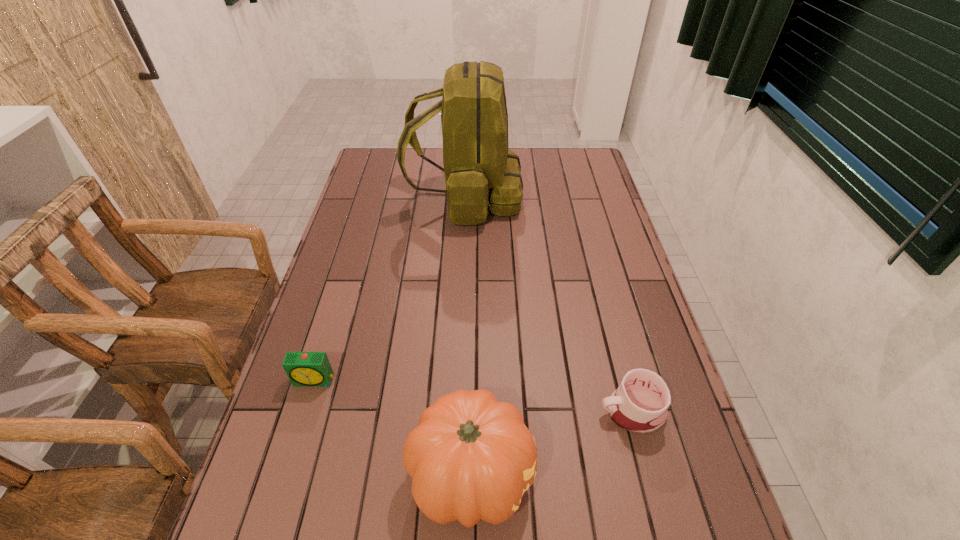
I want to click on object positioned at the far edge, so click(480, 171).

This screenshot has width=960, height=540. I want to click on object that is at the left edge, so click(302, 368).

The image size is (960, 540). I want to click on object that is at the right edge, so click(x=639, y=405).

Where is `vacant space at the far edge of the desktop`? vacant space at the far edge of the desktop is located at coordinates (409, 157).

Locate an element on the screen. free space at the left edge is located at coordinates (290, 413).

At what (x,y) coordinates should I click in order to perform the action: click on free spot at the right edge of the desktop. Please return your answer as a coordinate pair (x, y). Image resolution: width=960 pixels, height=540 pixels. Looking at the image, I should click on (664, 511).

Locate an element on the screen. This screenshot has height=540, width=960. vacant space at the far left corner of the desktop is located at coordinates (394, 176).

Find the location of a particular element. vacant area that lies between the second farthest object and the farthest object is located at coordinates (390, 288).

The height and width of the screenshot is (540, 960). Find the location of `empty location between the farthest object and the mug`. empty location between the farthest object and the mug is located at coordinates (548, 303).

In order to click on vacant space that is in between the farthest object and the mug in this screenshot , I will do `click(548, 303)`.